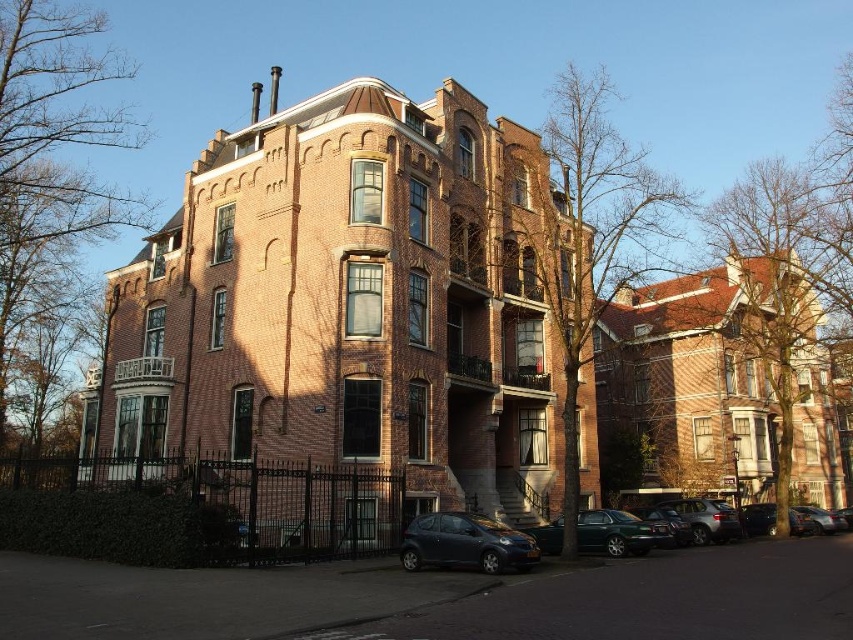
You are a delivery person approaching the residential building and need to park your vehicle. You see a matte black car at lower center and a metallic gray hatchback at lower center. Which vehicle is positioned to the right side of the other?

The matte black car at lower center is positioned to the right of the metallic gray hatchback at lower center.

You are a delivery person trying to park your van between the matte black car at lower center and the green matte car at lower center. The van is 6 meters long. Can you fit it there?

The matte black car at lower center is bigger than green matte car at lower center, but the exact distance between them is not provided. Without knowing the space between the two cars, it is impossible to determine if the van will fit.